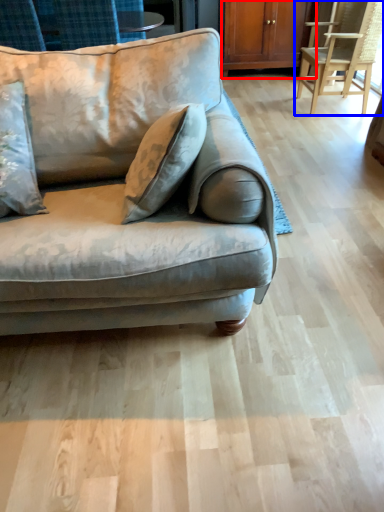
Question: Among these objects, which one is nearest to the camera, dresser (highlighted by a red box) or chair (highlighted by a blue box)?

Choices:
 (A) dresser
 (B) chair

Answer: (B)